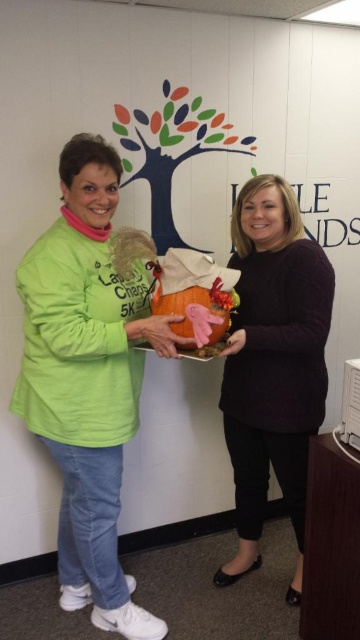
Question: Does matte green shirt at left have a smaller size compared to matte black sweater at center?

Choices:
 (A) yes
 (B) no

Answer: (B)

Question: Does matte green shirt at left have a larger size compared to matte black sweater at center?

Choices:
 (A) no
 (B) yes

Answer: (B)

Question: Which point is closer to the camera taking this photo?

Choices:
 (A) (326, 388)
 (B) (78, 282)

Answer: (B)

Question: From the image, what is the correct spatial relationship of matte green shirt at left in relation to matte black sweater at center?

Choices:
 (A) below
 (B) above

Answer: (B)

Question: Which point is closer to the camera taking this photo?

Choices:
 (A) (186, 340)
 (B) (235, 449)

Answer: (A)